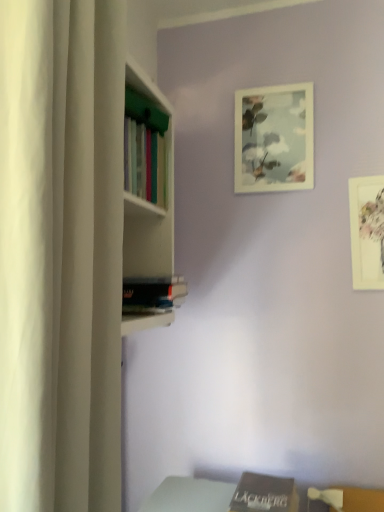
Question: From a real-world perspective, is white matte curtain at left physically located above or below matte white picture frame at upper center, arranged as the 1th picture frame when viewed from the top?

Choices:
 (A) above
 (B) below

Answer: (B)

Question: In the image, is white matte curtain at left positioned in front of or behind matte white picture frame at upper center, the 1th picture frame positioned from the left?

Choices:
 (A) behind
 (B) front

Answer: (B)

Question: Estimate the real-world distances between objects in this image. Which object is farther from the white matte picture frame at upper right, the 2th picture frame when ordered from top to bottom?

Choices:
 (A) white matte curtain at left
 (B) brown matte book at lower center, positioned as the second book in left-to-right order
 (C) matte white picture frame at upper center, the 1th picture frame positioned from the left
 (D) hardcover book at center, the 1th book from the left

Answer: (A)

Question: Which object is positioned closest to the brown matte book at lower center, positioned as the second book in left-to-right order?

Choices:
 (A) white matte curtain at left
 (B) hardcover book at center, the first book from the top
 (C) matte white picture frame at upper center, which is the 1th picture frame from back to front
 (D) white matte picture frame at upper right, the 1th picture frame ordered from the bottom

Answer: (B)